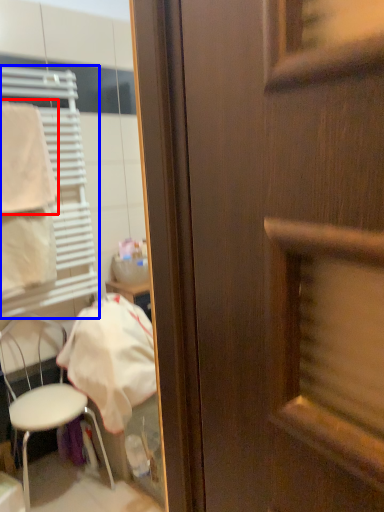
Question: Which object appears closest to the camera in this image, towel/napkin (highlighted by a red box) or shutter (highlighted by a blue box)?

Choices:
 (A) towel/napkin
 (B) shutter

Answer: (B)